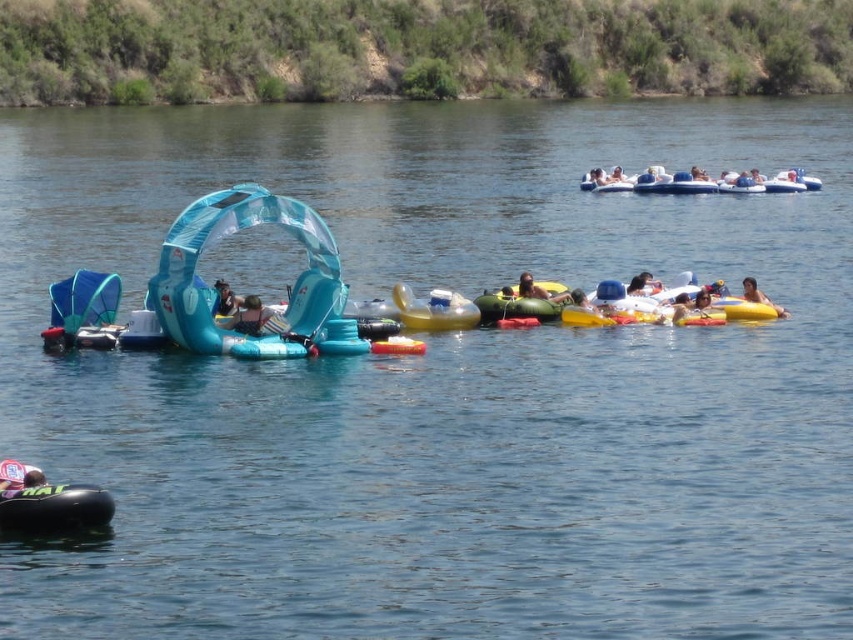
The width and height of the screenshot is (853, 640). I want to click on translucent rubber raft at center, so click(x=213, y=292).

Does point (173, 316) lie in front of point (717, 307)?

Yes, it is in front of point (717, 307).

This screenshot has height=640, width=853. I want to click on translucent rubber raft at center, so click(x=213, y=292).

Is yellow rubber boat at center to the left of dark brown hair at center from the viewer's perspective?

Correct, you'll find yellow rubber boat at center to the left of dark brown hair at center.

Is yellow rubber boat at center thinner than dark brown hair at center?

Incorrect, yellow rubber boat at center's width is not less than dark brown hair at center's.

Find the location of `yellow rubber boat at center`. yellow rubber boat at center is located at coordinates (434, 308).

Who is shorter, yellow rubber boat at center-right or yellow rubber ring at center?

yellow rubber boat at center-right

Does yellow rubber boat at center-right appear on the left side of yellow rubber ring at center?

In fact, yellow rubber boat at center-right is to the right of yellow rubber ring at center.

Is point (729, 307) farther from viewer compared to point (556, 298)?

No, it is not.

Locate an element on the screen. The image size is (853, 640). yellow rubber boat at center-right is located at coordinates (744, 308).